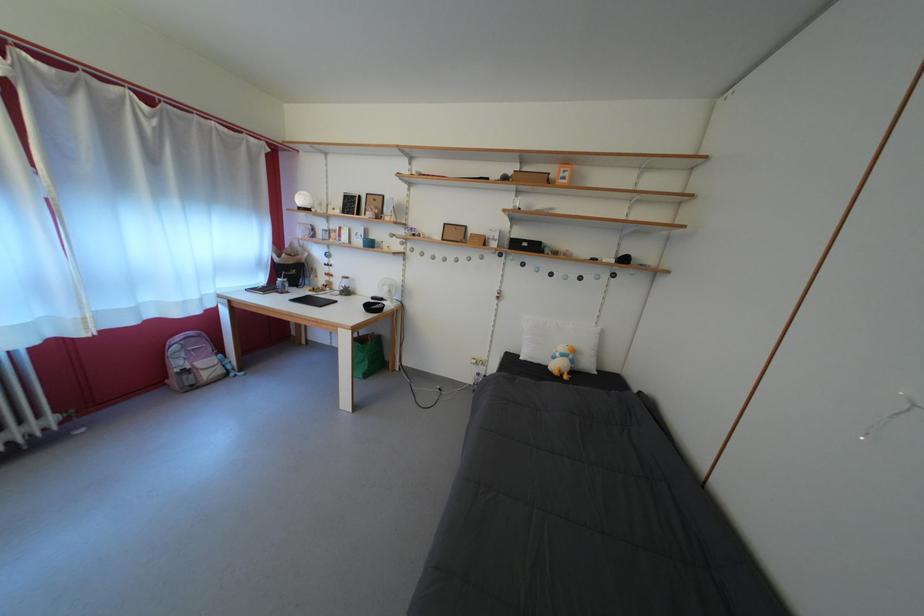
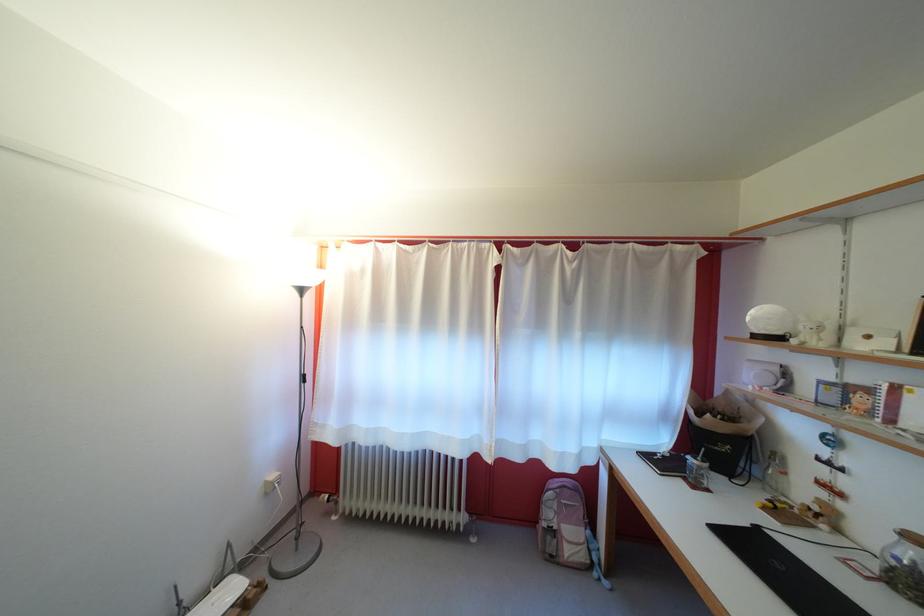
Where in the second image is the point corresponding to point 346,299 from the first image?

(881, 570)